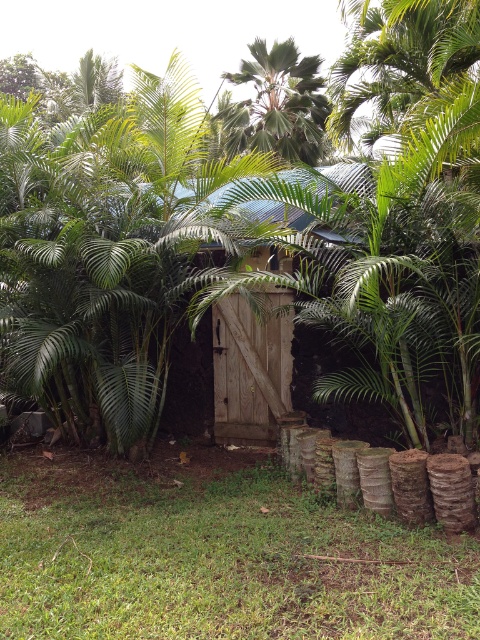
You are standing in a tropical garden and want to take a photo of the point at coordinates (193,300). Your camera has a focal length of 50mm and a sensor size of 24mm. What is the minimum distance you need to move closer to ensure the point fills the frame vertically?

The point at coordinates (193,300) is 5.76 meters from the camera. To calculate the minimum distance needed, use the formula distance_sensor_to_subject_in_mm divided by focal_length_mm multiplied by sensor_size_mm. Plugging in the values, 50mm divided by 24mm equals approximately 2.083. Multiply this by the current distance of 5.76 meters, resulting in approximately 11.96 meters. Therefore, you need to move closer to about 12 meters to ensure the point fills the frame vertically.

You are a gardener who needs to prune the green leafy tree at center and the wooden door at center. Which object requires pruning because it is taller?

The green leafy tree at center requires pruning because it is much taller than the wooden door at center.

You are standing in a tropical garden and see the green leafy tree at center and the wooden door at center. Which object is closer to you?

The green leafy tree at center is closer to the viewer than the wooden door at center.